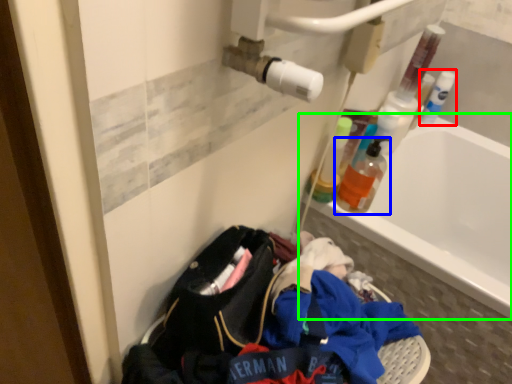
Question: Based on their relative distances, which object is nearer to bottle (highlighted by a red box)? Choose from bottle (highlighted by a blue box) and bathtub (highlighted by a green box).

Choices:
 (A) bottle
 (B) bathtub

Answer: (B)